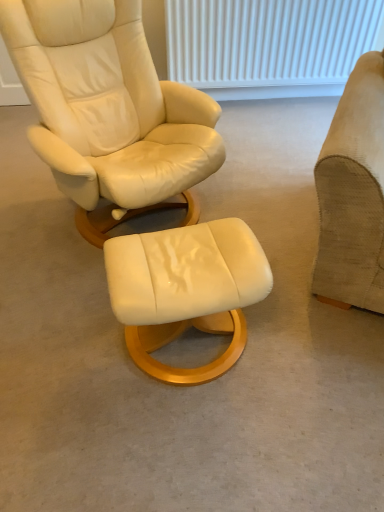
I want to click on vacant area located to the right-hand side of matte cream leather stool at center, so click(x=305, y=354).